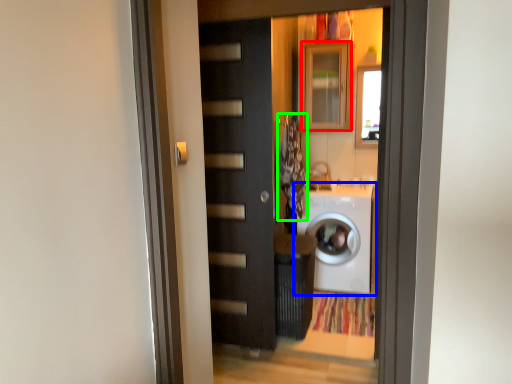
Question: Estimate the real-world distances between objects in this image. Which object is farther from cabinetry (highlighted by a red box), washing machine (highlighted by a blue box) or laundry (highlighted by a green box)?

Choices:
 (A) washing machine
 (B) laundry

Answer: (A)